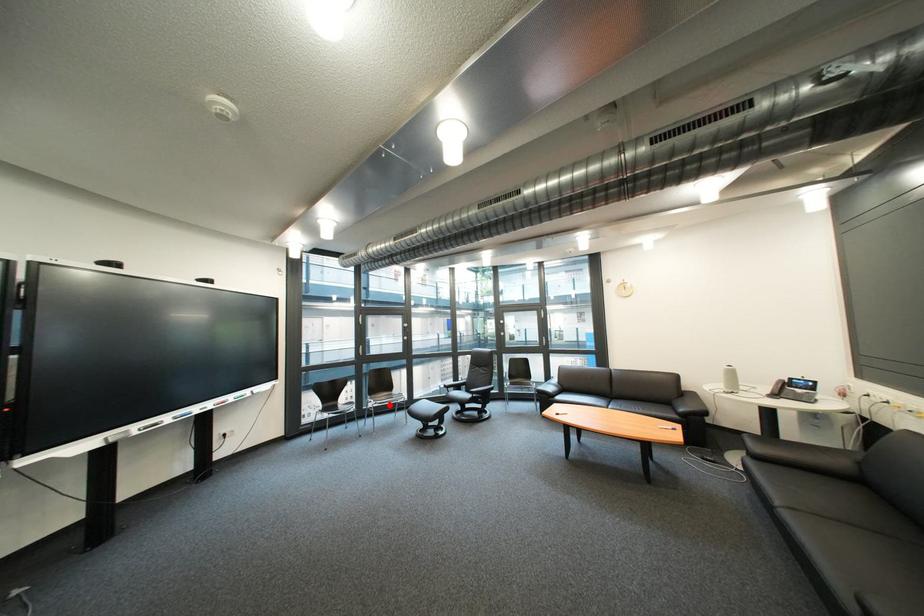
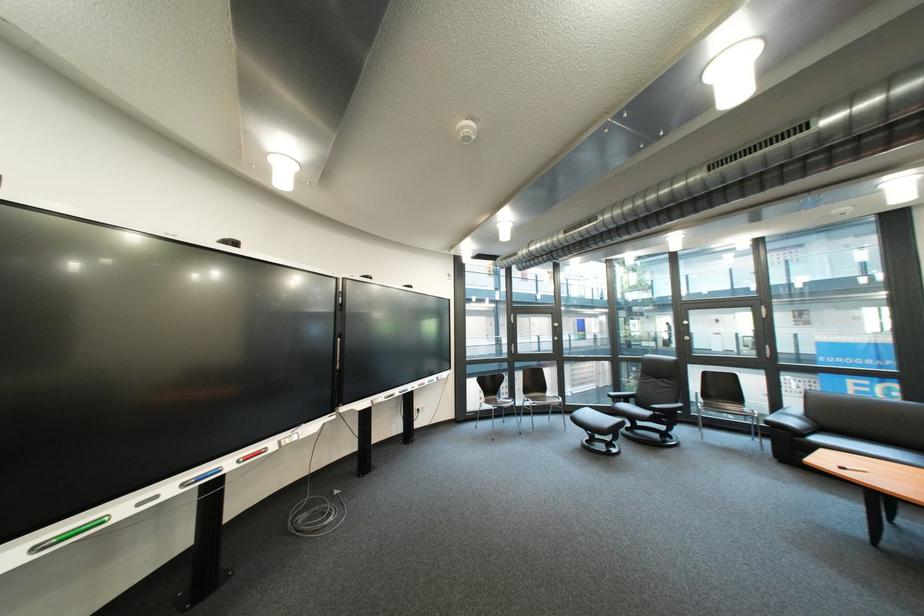
Find the pixel in the second image that matches the highlighted location in the first image.

(548, 405)